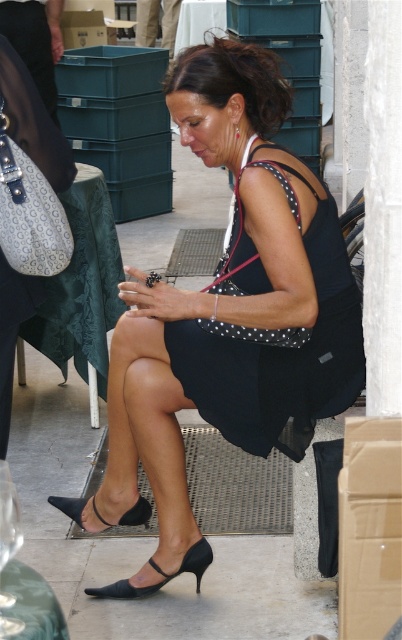
Can you confirm if black dotted dress at center is shorter than black dotted fabric dress at center?

In fact, black dotted dress at center may be taller than black dotted fabric dress at center.

Is black dotted dress at center positioned before black dotted fabric dress at center?

Yes, it is.

Where is `black dotted dress at center`? This screenshot has width=402, height=640. black dotted dress at center is located at coordinates (233, 304).

Is black dotted fabric dress at center positioned in front of black leather sandal at lower center?

Yes, black dotted fabric dress at center is closer to the viewer.

Does black dotted fabric dress at center have a greater width compared to black leather sandal at lower center?

Yes.

Does point (276, 346) lie behind point (129, 512)?

That is False.

Locate an element on the screen. The width and height of the screenshot is (402, 640). black dotted fabric dress at center is located at coordinates (280, 349).

Does black dotted fabric dress at center have a lesser height compared to black leather high-heeled sandal at lower center?

Incorrect, black dotted fabric dress at center's height does not fall short of black leather high-heeled sandal at lower center's.

This screenshot has height=640, width=402. What do you see at coordinates (280, 349) in the screenshot? I see `black dotted fabric dress at center` at bounding box center [280, 349].

Does point (313, 356) come farther from viewer compared to point (205, 560)?

That is False.

The width and height of the screenshot is (402, 640). What are the coordinates of `black dotted fabric dress at center` in the screenshot? It's located at (280, 349).